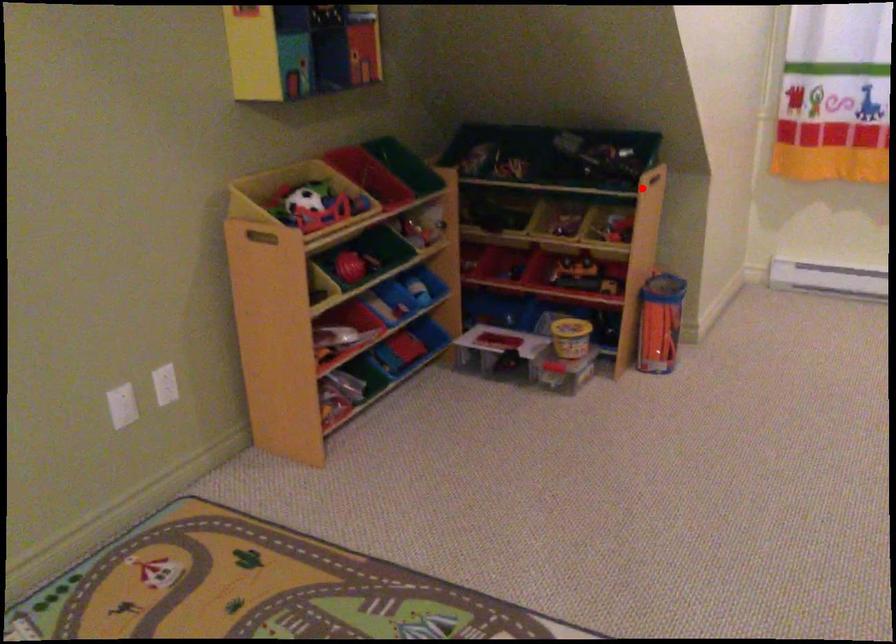
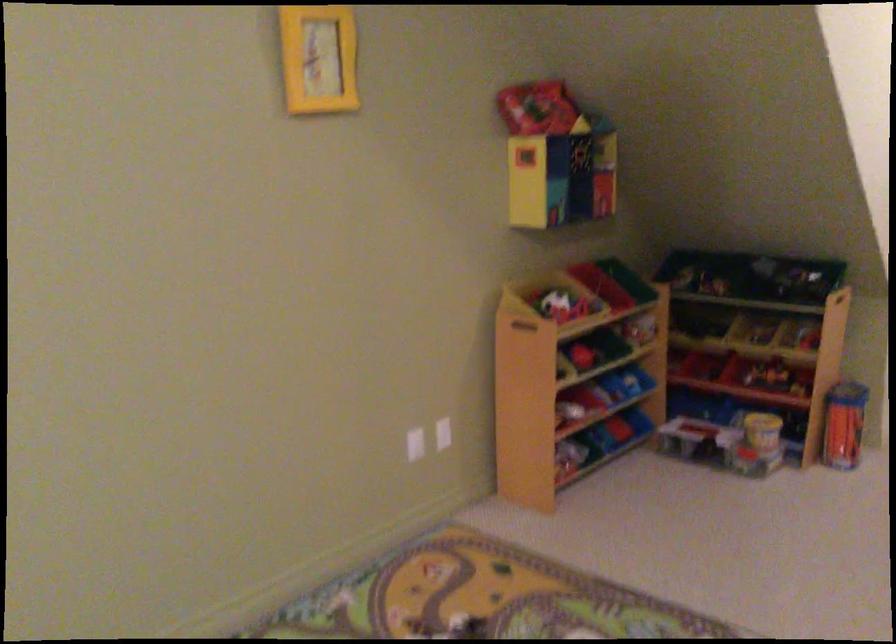
Question: I am providing you with two images of the same scene from different viewpoints. A red point is shown in image1. For the corresponding object point in image2, is it positioned nearer or farther from the camera?

Choices:
 (A) Nearer
 (B) Farther

Answer: (B)